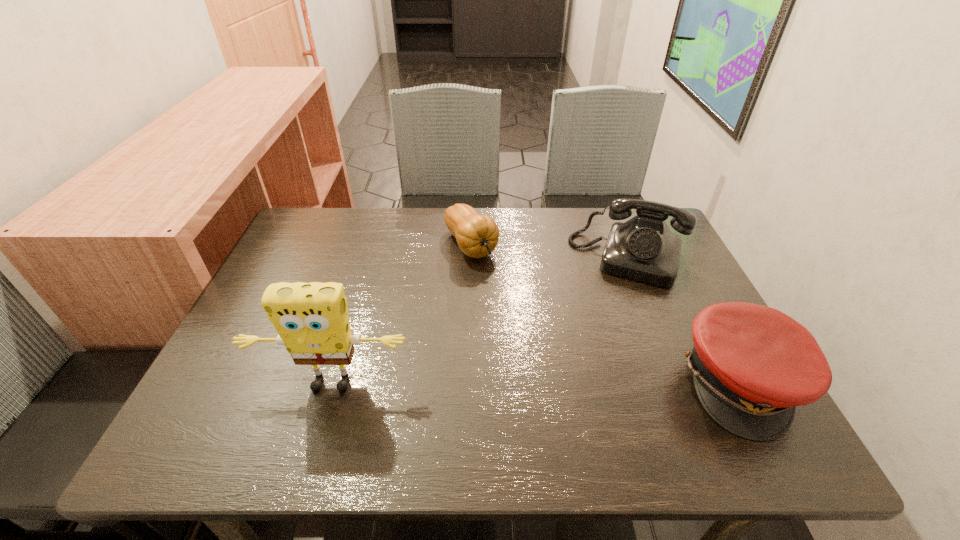
This screenshot has width=960, height=540. I want to click on object that is at the near right corner, so click(752, 365).

The height and width of the screenshot is (540, 960). In the image, there is a desktop. Find the location of `vacant space at the far edge`. vacant space at the far edge is located at coordinates (407, 228).

The image size is (960, 540). In the image, there is a desktop. Find the location of `vacant space at the near edge`. vacant space at the near edge is located at coordinates (619, 402).

Find the location of a particular element. The width and height of the screenshot is (960, 540). free space at the left edge of the desktop is located at coordinates (275, 347).

This screenshot has height=540, width=960. I want to click on vacant space at the right edge of the desktop, so click(x=688, y=289).

In the image, there is a desktop. Identify the location of free space at the far left corner. The height and width of the screenshot is (540, 960). (340, 216).

Where is `empty space between the cap and the second object from left to right`? This screenshot has width=960, height=540. empty space between the cap and the second object from left to right is located at coordinates (607, 314).

Where is `blank region between the third shortest object and the cap`? This screenshot has height=540, width=960. blank region between the third shortest object and the cap is located at coordinates (685, 320).

Identify the location of blank region between the tallest object and the cap. (536, 384).

Locate an element on the screen. The height and width of the screenshot is (540, 960). blank region between the leftmost object and the gourd is located at coordinates (400, 315).